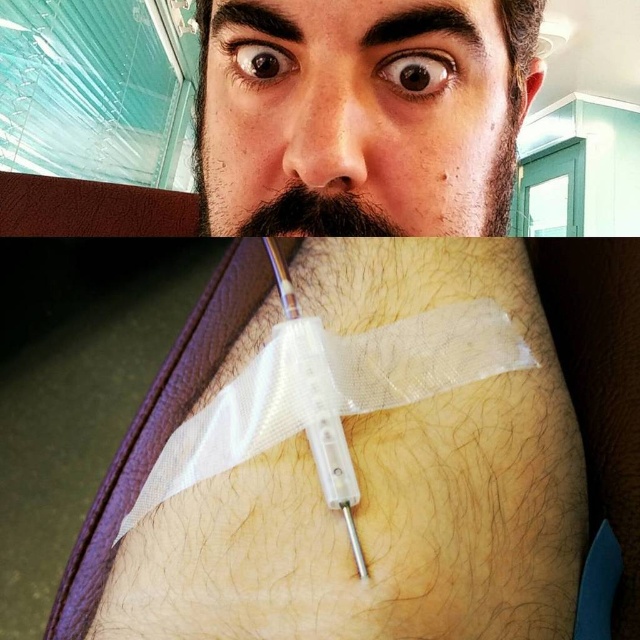
Question: Where is matte black face at upper center located in relation to transparent plastic syringe at center in the image?

Choices:
 (A) right
 (B) left

Answer: (A)

Question: Can you confirm if hair-covered skin at center is positioned below brown fuzzy beard at upper center?

Choices:
 (A) no
 (B) yes

Answer: (B)

Question: Can you confirm if hair-covered skin at center is wider than matte black face at upper center?

Choices:
 (A) yes
 (B) no

Answer: (B)

Question: Which is nearer to the hair-covered skin at center?

Choices:
 (A) transparent plastic syringe at center
 (B) matte black face at upper center

Answer: (A)

Question: Estimate the real-world distances between objects in this image. Which object is farther from the matte black face at upper center?

Choices:
 (A) hair-covered skin at center
 (B) brown fuzzy beard at upper center
 (C) transparent plastic syringe at center

Answer: (C)

Question: Among these points, which one is nearest to the camera?

Choices:
 (A) (324, 195)
 (B) (282, 276)
 (C) (305, 209)
 (D) (536, 449)

Answer: (D)